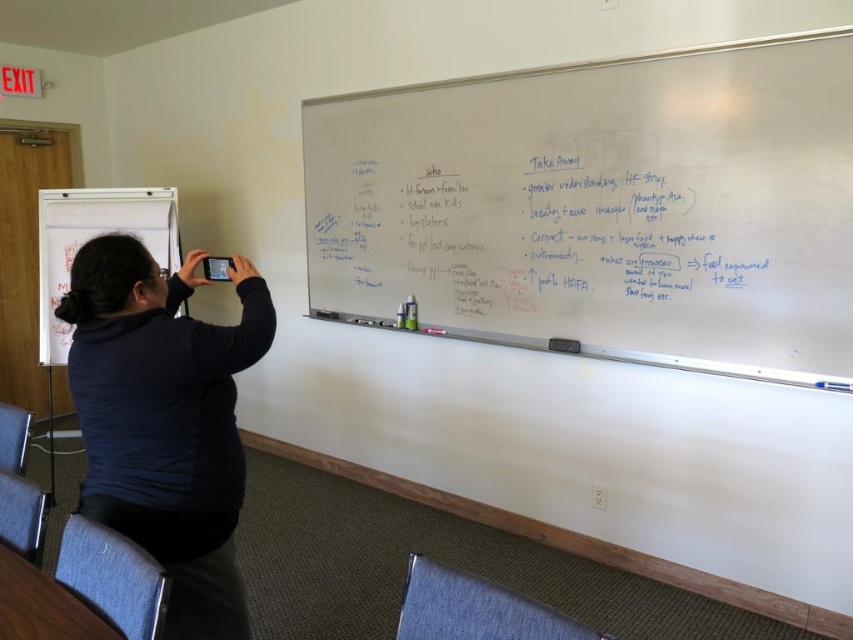
You are standing in the classroom and want to reach a specific point on the whiteboard. The point is located at coordinates point (229,586). Considering your height, can you comfortably reach this point without needing a stool?

The distance of point (229,586) from viewer is 5.45 feet, so yes, you can comfortably reach this point without needing a stool since it is within a typical comfortable reaching distance.